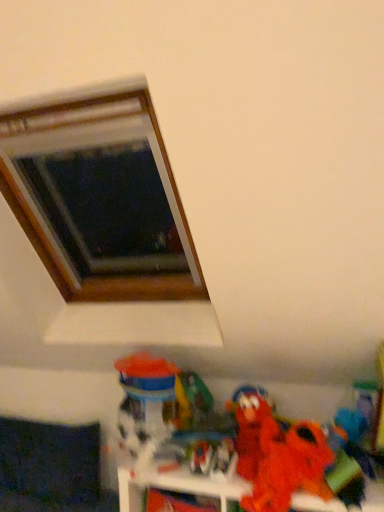
Question: Does fuzzy fabric plush at lower right turn towards translucent plastic toy at lower center, which ranks as the first toy in left-to-right order?

Choices:
 (A) no
 (B) yes

Answer: (A)

Question: Does fuzzy fabric plush at lower right have a smaller size compared to translucent plastic toy at lower center, acting as the 5th toy starting from the right?

Choices:
 (A) yes
 (B) no

Answer: (B)

Question: From the image's perspective, does fuzzy fabric plush at lower right appear higher than translucent plastic toy at lower center, which ranks as the first toy in left-to-right order?

Choices:
 (A) no
 (B) yes

Answer: (A)

Question: Is fuzzy fabric plush at lower right closer to camera compared to translucent plastic toy at lower center, acting as the 5th toy starting from the right?

Choices:
 (A) yes
 (B) no

Answer: (A)

Question: From a real-world perspective, does fuzzy fabric plush at lower right stand above translucent plastic toy at lower center, acting as the 5th toy starting from the right?

Choices:
 (A) no
 (B) yes

Answer: (A)

Question: Considering the positions of matte plastic toy at lower center, the fourth toy positioned from the right, and dark fabric couch at lower left in the image, is matte plastic toy at lower center, the fourth toy positioned from the right, taller or shorter than dark fabric couch at lower left?

Choices:
 (A) short
 (B) tall

Answer: (A)

Question: From the image's perspective, is matte plastic toy at lower center, the fourth toy positioned from the right, positioned above or below dark fabric couch at lower left?

Choices:
 (A) above
 (B) below

Answer: (A)

Question: Is matte plastic toy at lower center, the fourth toy positioned from the right, situated inside dark fabric couch at lower left or outside?

Choices:
 (A) outside
 (B) inside

Answer: (A)

Question: Considering the positions of matte plastic toy at lower center, the fourth toy positioned from the right, and dark fabric couch at lower left in the image, is matte plastic toy at lower center, the fourth toy positioned from the right, wider or thinner than dark fabric couch at lower left?

Choices:
 (A) thin
 (B) wide

Answer: (A)

Question: From the image's perspective, is matte plastic toy at lower center, arranged as the third toy when viewed from the right, above or below matte red plush at lower right, placed as the second toy when sorted from right to left?

Choices:
 (A) above
 (B) below

Answer: (B)

Question: From a real-world perspective, is matte plastic toy at lower center, the 3th toy in the left-to-right sequence, physically located above or below matte red plush at lower right, acting as the fourth toy starting from the left?

Choices:
 (A) below
 (B) above

Answer: (A)

Question: In the image, is matte plastic toy at lower center, the 3th toy in the left-to-right sequence, positioned in front of or behind matte red plush at lower right, acting as the fourth toy starting from the left?

Choices:
 (A) front
 (B) behind

Answer: (B)

Question: From their relative heights in the image, would you say matte plastic toy at lower center, arranged as the third toy when viewed from the right, is taller or shorter than matte red plush at lower right, acting as the fourth toy starting from the left?

Choices:
 (A) tall
 (B) short

Answer: (B)

Question: Considering the positions of matte plastic toy at lower center, the fourth toy positioned from the right, and fuzzy red plush at lower right, which is the first toy from right to left, in the image, is matte plastic toy at lower center, the fourth toy positioned from the right, taller or shorter than fuzzy red plush at lower right, which is the first toy from right to left,?

Choices:
 (A) short
 (B) tall

Answer: (A)

Question: From a real-world perspective, is matte plastic toy at lower center, positioned as the 2th toy in left-to-right order, positioned above or below fuzzy red plush at lower right, which is the first toy from right to left?

Choices:
 (A) above
 (B) below

Answer: (B)